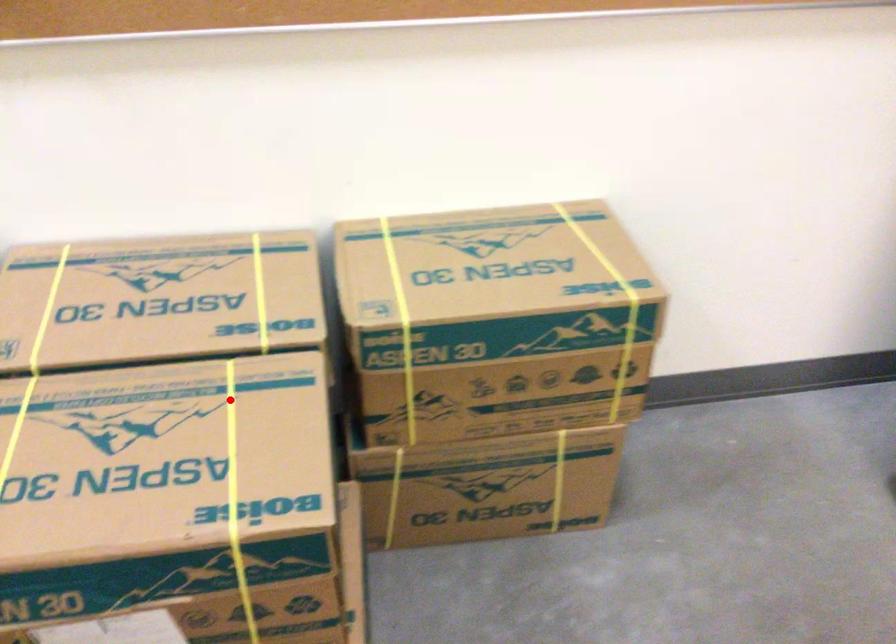
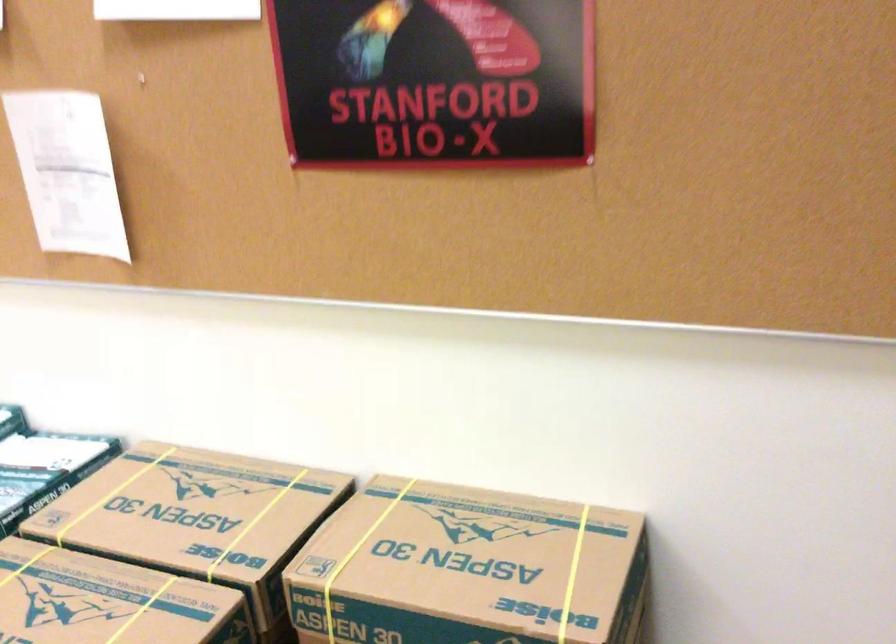
Find the pixel in the second image that matches the highlighted location in the first image.

(142, 609)